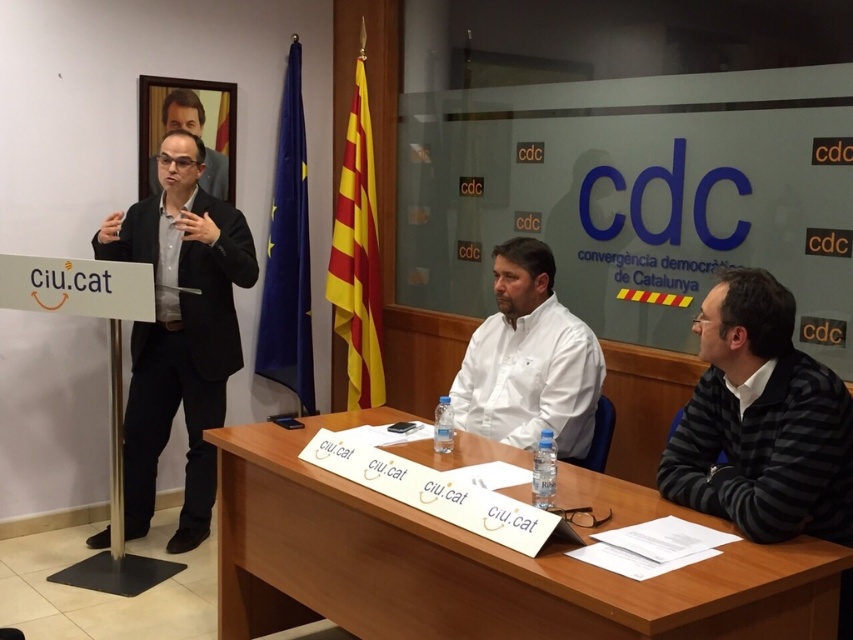
Does white cotton shirt at center appear over matte black suit at upper left?

No, white cotton shirt at center is not above matte black suit at upper left.

Describe the element at coordinates (529, 358) in the screenshot. I see `white cotton shirt at center` at that location.

Which is in front, point (506, 396) or point (206, 164)?

Point (506, 396) is in front.

In order to click on white cotton shirt at center in this screenshot , I will do `click(529, 358)`.

Is light brown wooden table at center wider than black suit at left?

Correct, the width of light brown wooden table at center exceeds that of black suit at left.

Is light brown wooden table at center below black suit at left?

Yes, light brown wooden table at center is below black suit at left.

Is point (242, 522) more distant than point (196, 445)?

No, (242, 522) is closer to viewer.

Find the location of `light brown wooden table at center`. light brown wooden table at center is located at coordinates (468, 564).

Who is positioned more to the left, black suit at left or white cotton shirt at center?

black suit at left

Is point (200, 291) more distant than point (556, 317)?

Yes, point (200, 291) is behind point (556, 317).

Where is `black suit at left`? The width and height of the screenshot is (853, 640). black suit at left is located at coordinates (178, 332).

Where is `black suit at left`? Image resolution: width=853 pixels, height=640 pixels. black suit at left is located at coordinates coord(178,332).